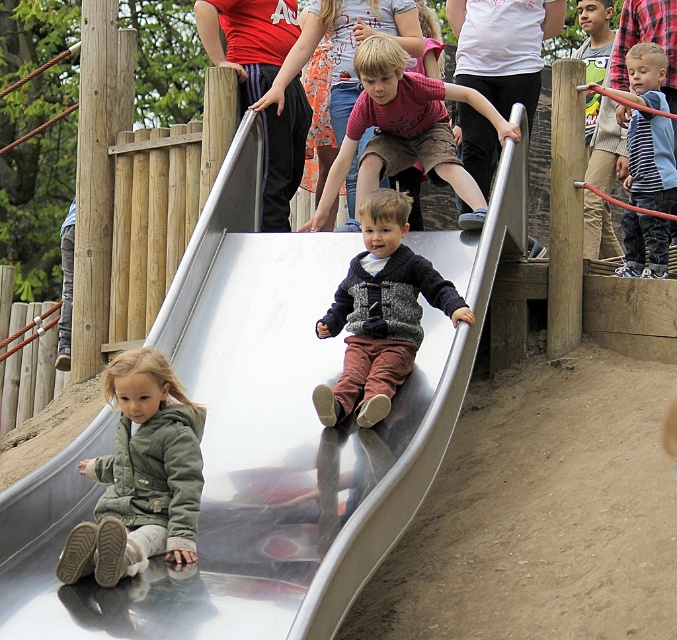
Question: Which of the following is the farthest from the observer?

Choices:
 (A) (305, 500)
 (B) (137, 524)
 (C) (412, 256)

Answer: (C)

Question: Estimate the real-world distances between objects in this image. Which object is closer to the green fleece jacket at lower left?

Choices:
 (A) matte red shirt at center
 (B) metallic smooth slide at center
 (C) knitted sweater at center

Answer: (B)

Question: Considering the relative positions of metallic smooth slide at center and knitted sweater at center in the image provided, where is metallic smooth slide at center located with respect to knitted sweater at center?

Choices:
 (A) right
 (B) left

Answer: (B)

Question: Does metallic smooth slide at center come behind knitted sweater at center?

Choices:
 (A) no
 (B) yes

Answer: (A)

Question: Which object is the closest to the knitted sweater at center?

Choices:
 (A) metallic smooth slide at center
 (B) matte red shirt at center
 (C) green fleece jacket at lower left

Answer: (A)

Question: Does green fleece jacket at lower left appear on the left side of matte red shirt at center?

Choices:
 (A) no
 (B) yes

Answer: (B)